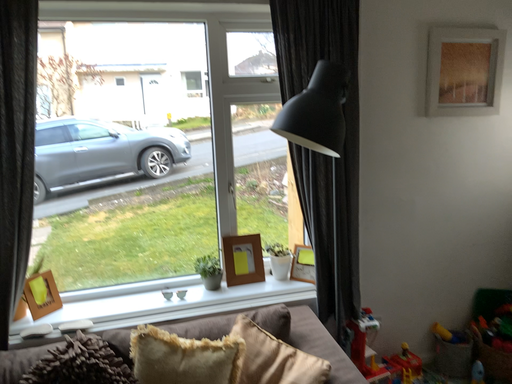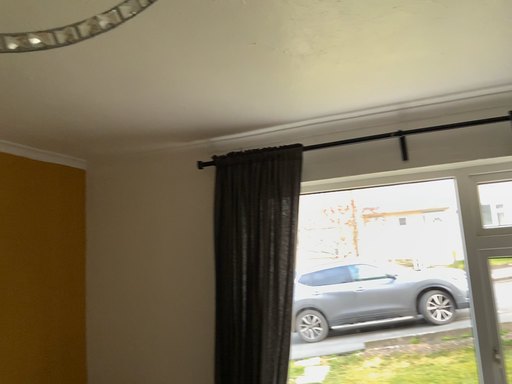
Question: Which way did the camera rotate in the video?

Choices:
 (A) rotated left
 (B) rotated right

Answer: (A)